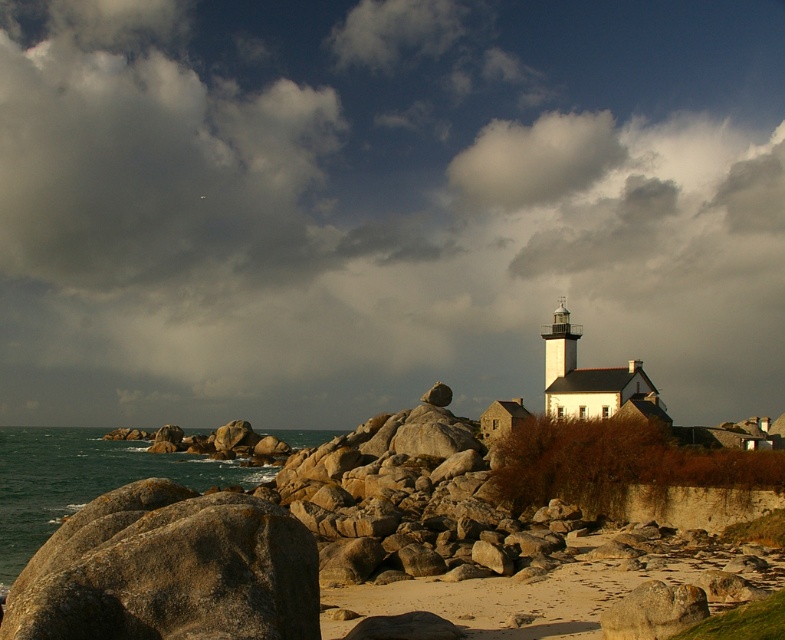
You are standing at the center of the image and want to move towards the brown rough rock at lower left. Based on its coordinates, which direction should you move?

The brown rough rock at lower left is located at coordinates point (184, 580), so you should move towards the lower left direction to reach it.